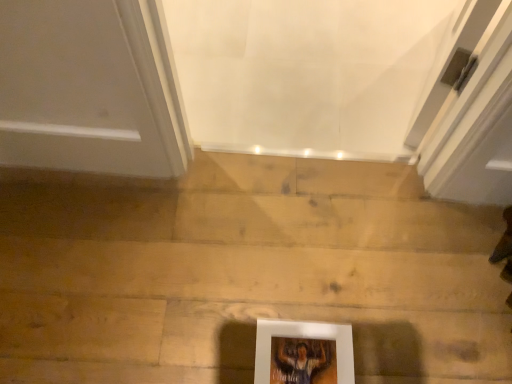
The width and height of the screenshot is (512, 384). What are the coordinates of `white matte picture frame at lower center` in the screenshot? It's located at (303, 352).

The height and width of the screenshot is (384, 512). Describe the element at coordinates (303, 352) in the screenshot. I see `white matte picture frame at lower center` at that location.

The width and height of the screenshot is (512, 384). Find the location of `white matte picture frame at lower center`. white matte picture frame at lower center is located at coordinates (303, 352).